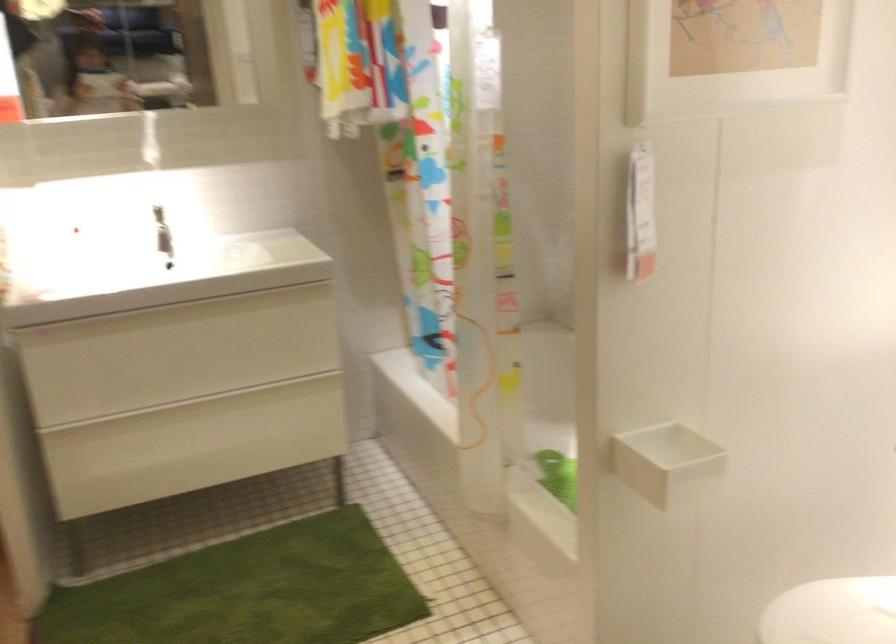
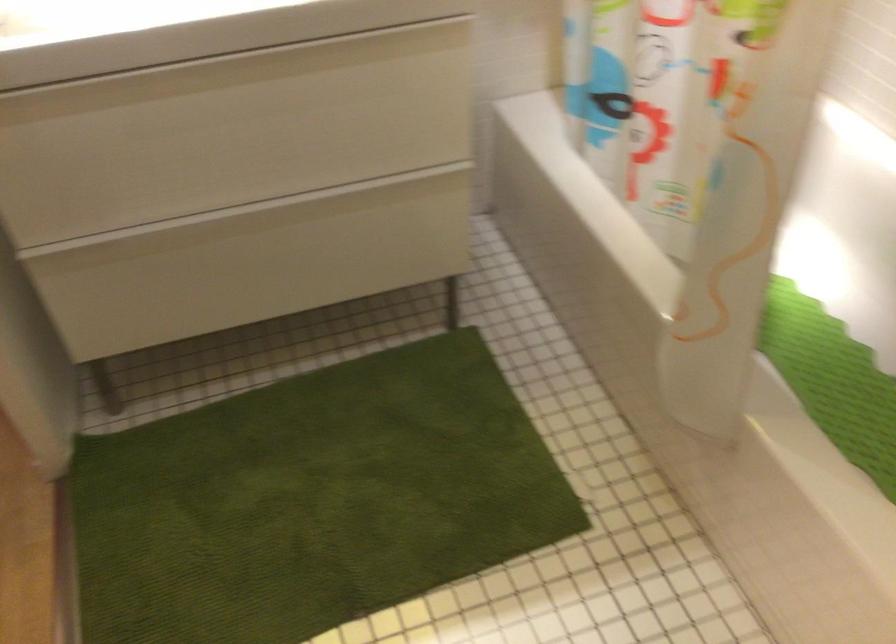
Find the pixel in the second image that matches (x=225, y=424) in the first image.

(289, 238)